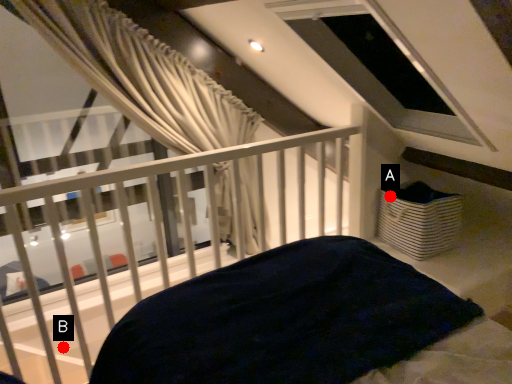
Question: Two points are circled on the image, labeled by A and B beside each circle. Which point is closer to the camera?

Choices:
 (A) A is closer
 (B) B is closer

Answer: (A)